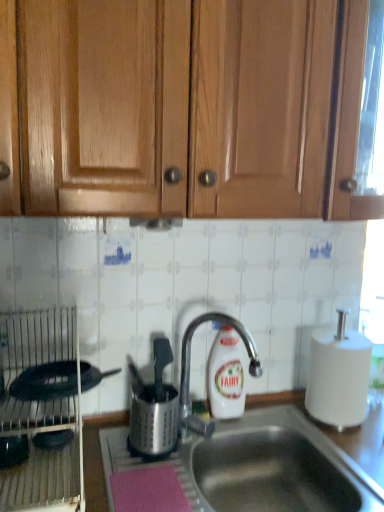
Question: Can silver metallic faucet at center be found inside wooden cabinet doors at upper center?

Choices:
 (A) no
 (B) yes

Answer: (A)

Question: Considering the relative sizes of wooden cabinet doors at upper center and silver metallic faucet at center in the image provided, is wooden cabinet doors at upper center wider than silver metallic faucet at center?

Choices:
 (A) no
 (B) yes

Answer: (B)

Question: Is wooden cabinet doors at upper center thinner than silver metallic faucet at center?

Choices:
 (A) yes
 (B) no

Answer: (B)

Question: Does wooden cabinet doors at upper center have a lesser height compared to silver metallic faucet at center?

Choices:
 (A) yes
 (B) no

Answer: (B)

Question: Can you confirm if wooden cabinet doors at upper center is positioned to the left of silver metallic faucet at center?

Choices:
 (A) no
 (B) yes

Answer: (A)

Question: Is wooden cabinet doors at upper center behind silver metallic faucet at center?

Choices:
 (A) no
 (B) yes

Answer: (A)

Question: Is metallic silver dish rack at left, the second appliance viewed from the right, outside of white matte paper towel at right?

Choices:
 (A) yes
 (B) no

Answer: (A)

Question: Is metallic silver dish rack at left, the second appliance viewed from the right, facing away from white matte paper towel at right?

Choices:
 (A) yes
 (B) no

Answer: (B)

Question: Is metallic silver dish rack at left, which ranks as the first appliance in left-to-right order, further to camera compared to white matte paper towel at right?

Choices:
 (A) yes
 (B) no

Answer: (B)

Question: From the image's perspective, does metallic silver dish rack at left, which ranks as the first appliance in left-to-right order, appear lower than white matte paper towel at right?

Choices:
 (A) no
 (B) yes

Answer: (B)

Question: Does metallic silver dish rack at left, which ranks as the first appliance in left-to-right order, have a smaller size compared to white matte paper towel at right?

Choices:
 (A) yes
 (B) no

Answer: (B)

Question: Is metallic silver dish rack at left, the second appliance viewed from the right, positioned far away from white matte paper towel at right?

Choices:
 (A) no
 (B) yes

Answer: (A)

Question: Does stainless steel sink at center have a larger size compared to white matte paper towel at right?

Choices:
 (A) no
 (B) yes

Answer: (B)